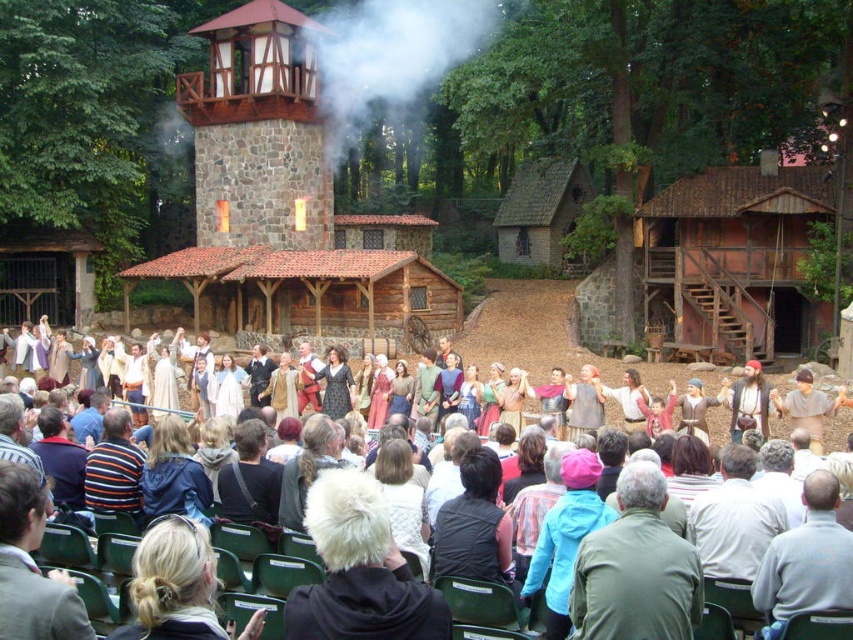
Can you confirm if blonde hair at center is bigger than smooth beige tunic at center?

Yes, blonde hair at center is bigger than smooth beige tunic at center.

How much distance is there between blonde hair at center and smooth beige tunic at center?

27.93 meters

Find the location of a particular element. This screenshot has width=853, height=640. blonde hair at center is located at coordinates (173, 584).

Based on the photo, can you confirm if dark brown leather jacket at center is positioned below striped cotton shirt at lower left?

Incorrect, dark brown leather jacket at center is not positioned below striped cotton shirt at lower left.

Who is shorter, dark brown leather jacket at center or striped cotton shirt at lower left?

striped cotton shirt at lower left is shorter.

This screenshot has width=853, height=640. In order to click on dark brown leather jacket at center in this screenshot , I will do `click(248, 477)`.

Is gray sweater at lower right positioned in front of matte brown leather jacket at center?

Yes, it is.

Is gray sweater at lower right to the right of matte brown leather jacket at center from the viewer's perspective?

In fact, gray sweater at lower right is to the left of matte brown leather jacket at center.

Which is in front, point (805, 540) or point (664, 406)?

Point (805, 540) is more forward.

The image size is (853, 640). In order to click on gray sweater at lower right in this screenshot , I will do `click(805, 561)`.